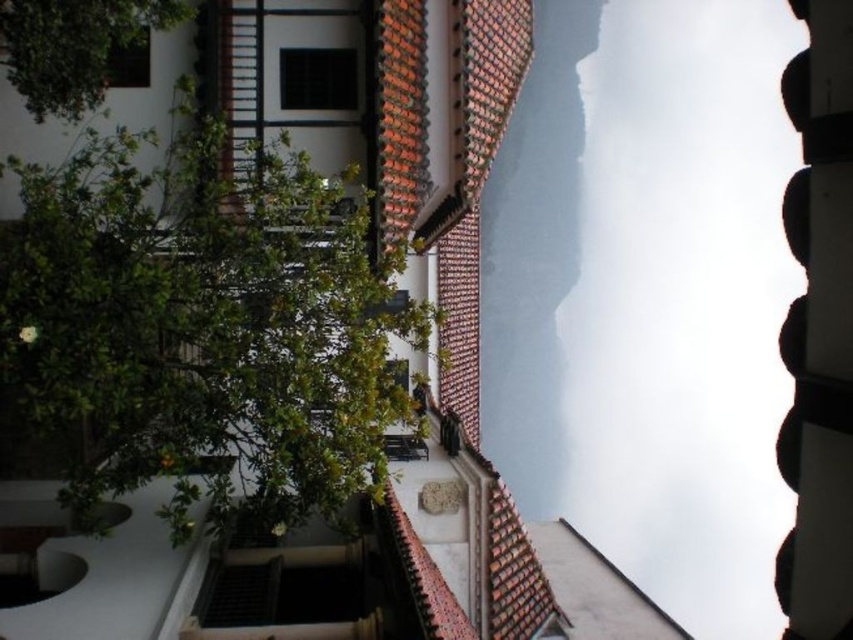
Can you confirm if green leafy tree at upper left is taller than black glass window at upper left?

Correct, green leafy tree at upper left is much taller as black glass window at upper left.

Does green leafy tree at upper left come behind black glass window at upper left?

No, green leafy tree at upper left is closer to the viewer.

Does point (141, 1) come behind point (142, 56)?

No, (141, 1) is closer to viewer.

Find the location of a particular element. green leafy tree at upper left is located at coordinates (73, 45).

Between green leafy tree at upper left and transparent glass window at upper center, which one appears on the right side from the viewer's perspective?

From the viewer's perspective, transparent glass window at upper center appears more on the right side.

Does point (28, 90) come farther from viewer compared to point (347, 58)?

No, (28, 90) is closer to viewer.

The image size is (853, 640). I want to click on green leafy tree at upper left, so click(73, 45).

From the picture: Does green leafy tree at center have a greater width compared to green leafy tree at upper left?

Yes.

Is point (282, 492) less distant than point (42, 113)?

Yes, point (282, 492) is closer to viewer.

This screenshot has width=853, height=640. Identify the location of green leafy tree at center. (202, 323).